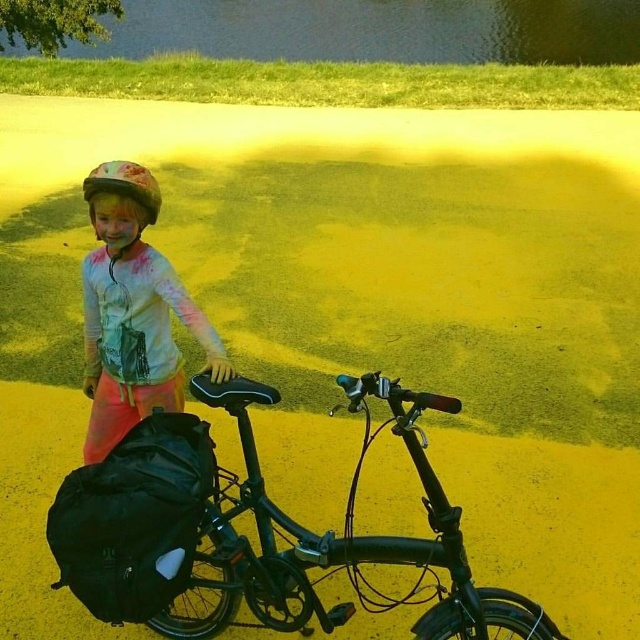
Based on the photo, who is taller, white matte shirt at upper left or matte white helmet at center?

white matte shirt at upper left is taller.

Between point (131, 276) and point (120, 161), which one is positioned in front?

Point (131, 276)

Locate an element on the screen. The width and height of the screenshot is (640, 640). white matte shirt at upper left is located at coordinates (132, 310).

Image resolution: width=640 pixels, height=640 pixels. I want to click on white matte shirt at upper left, so click(x=132, y=310).

Who is more forward, (452,586) or (163,392)?

Point (452,586) is in front.

Which is behind, point (468, 582) or point (131, 285)?

The point (131, 285) is behind.

Where is `shiny black bicycle at center`? The width and height of the screenshot is (640, 640). shiny black bicycle at center is located at coordinates (339, 536).

You are a GUI agent. You are given a task and a screenshot of the screen. Output one action in this format:
    pyautogui.click(x=<x>, y=<y>)
    Task: Click on the shiny black bicycle at center
    The height and width of the screenshot is (640, 640).
    Given the screenshot: What is the action you would take?
    pyautogui.click(x=339, y=536)

Can you confirm if shiny black bicycle at center is positioned below matte white helmet at center?

Indeed, shiny black bicycle at center is positioned under matte white helmet at center.

Image resolution: width=640 pixels, height=640 pixels. What do you see at coordinates (339, 536) in the screenshot?
I see `shiny black bicycle at center` at bounding box center [339, 536].

Find the location of a particular element. shiny black bicycle at center is located at coordinates (339, 536).